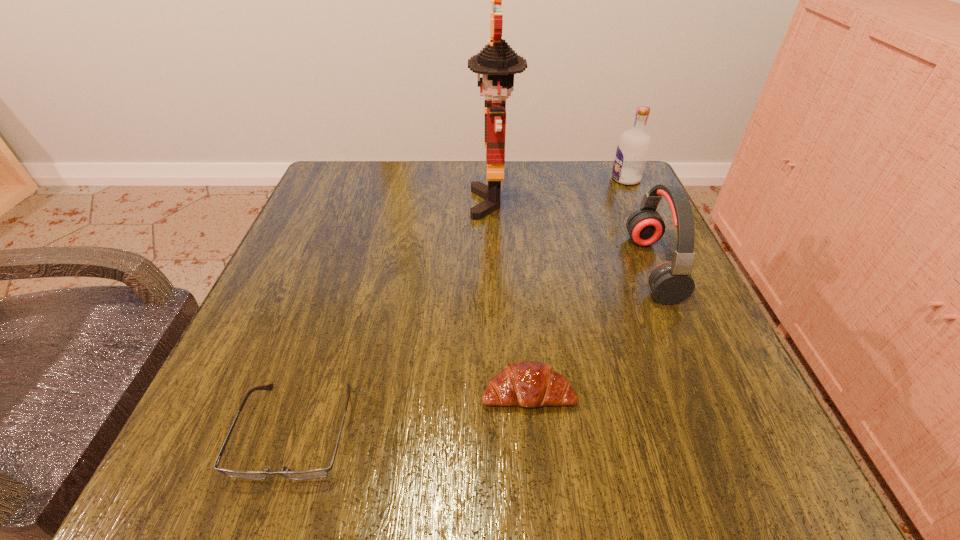
The height and width of the screenshot is (540, 960). In order to click on vodka present at the right edge in this screenshot , I will do `click(633, 148)`.

Identify the location of earphone that is at the right edge. This screenshot has height=540, width=960. (671, 282).

I want to click on object at the near left corner, so click(318, 473).

Find the location of a particular element. This screenshot has height=540, width=960. object present at the far right corner is located at coordinates coord(633,148).

The width and height of the screenshot is (960, 540). What are the coordinates of `free space at the far edge` in the screenshot? It's located at (505, 164).

Find the location of a particular element. The image size is (960, 540). free location at the near edge is located at coordinates (501, 450).

What are the coordinates of `vacant space at the left edge of the desktop` in the screenshot? It's located at (336, 237).

This screenshot has width=960, height=540. Identify the location of free location at the right edge. (595, 256).

What are the coordinates of `vacant space at the far right corner` in the screenshot? It's located at (617, 211).

Locate an element on the screen. The image size is (960, 540). free space between the crescent roll and the vodka is located at coordinates (577, 286).